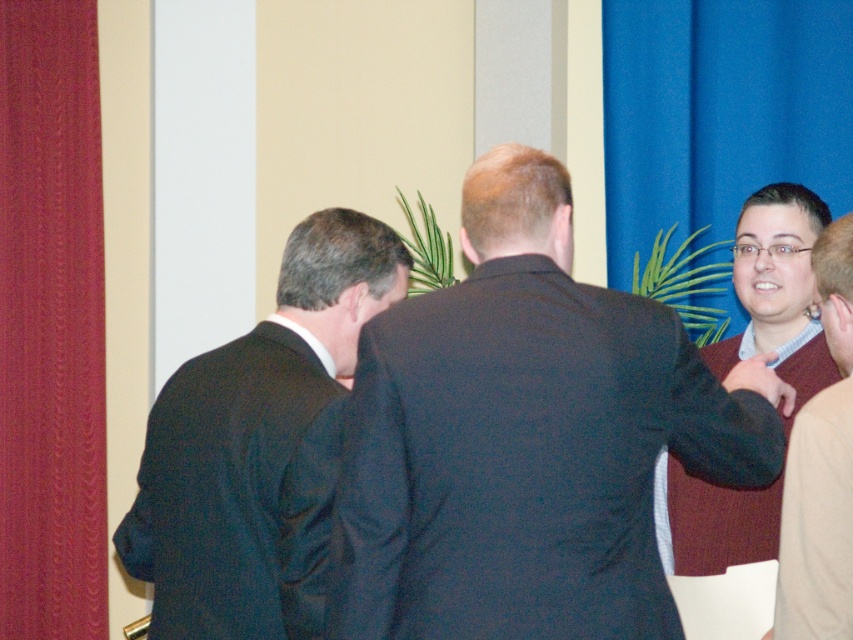
You are a photographer at this event and want to capture a photo of the matte black suit at center and the maroon sweater at right. Which of the two is closer to the camera?

The matte black suit at center is closer to the camera since the maroon sweater at right is behind it.

You are organizing a charity event and need to decide which of the two items, the matte black suit at center or the maroon sweater at right, can accommodate a larger donation box. Based on their sizes, which one would you choose?

The matte black suit at center is bigger than the maroon sweater at right, so the donation box would fit better on the matte black suit at center.